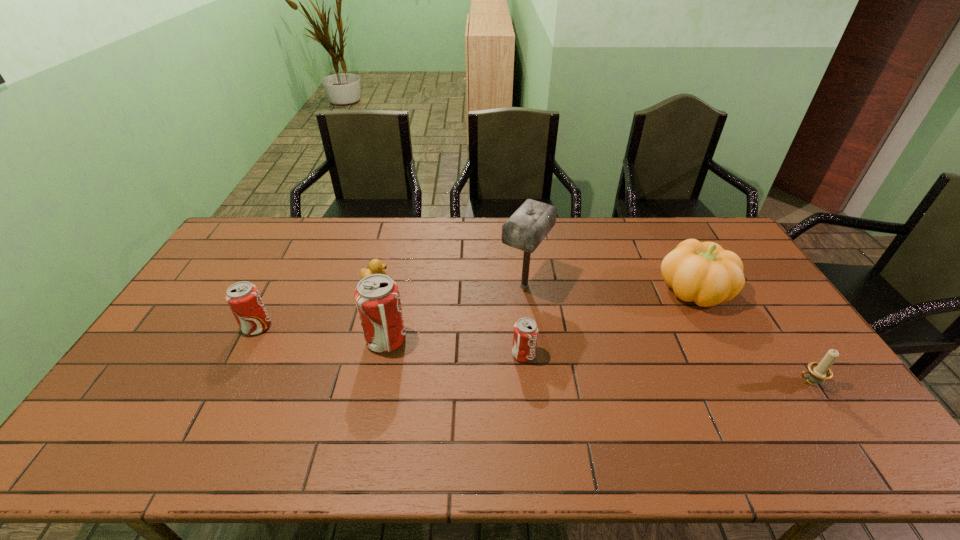
You are a GUI agent. You are given a task and a screenshot of the screen. Output one action in this format:
    pyautogui.click(x=<x>, y=<y>)
    Task: Click on the vacant position located on the back of the second tallest soda can
    
    Given the screenshot: What is the action you would take?
    pyautogui.click(x=300, y=245)

Where is `vacant space positioned 0.160m on the back of the tallest soda can`? vacant space positioned 0.160m on the back of the tallest soda can is located at coordinates coord(396,290).

Find the location of a particular element. Image resolution: width=960 pixels, height=540 pixels. vacant space located on the back of the rightmost soda can is located at coordinates (519, 304).

Image resolution: width=960 pixels, height=540 pixels. What are the coordinates of `free space located 0.080m on the front of the sixth object from left to right` in the screenshot? It's located at (718, 336).

Where is `free space located 0.330m on the right of the mallet`? The width and height of the screenshot is (960, 540). free space located 0.330m on the right of the mallet is located at coordinates (650, 286).

Locate an element on the screen. vacant region located on the face of the shortest object is located at coordinates (434, 279).

At what (x,y) coordinates should I click in order to perform the action: click on free region located 0.080m on the handle side of the nearest object. Please return your answer as a coordinate pair (x, y). The width and height of the screenshot is (960, 540). Looking at the image, I should click on (765, 382).

Image resolution: width=960 pixels, height=540 pixels. I want to click on free location located on the handle side of the nearest object, so click(x=746, y=382).

In order to click on free spot located 0.100m on the handle side of the nearest object in this screenshot , I will do `click(757, 382)`.

Image resolution: width=960 pixels, height=540 pixels. Identify the location of object that is at the near edge. (818, 371).